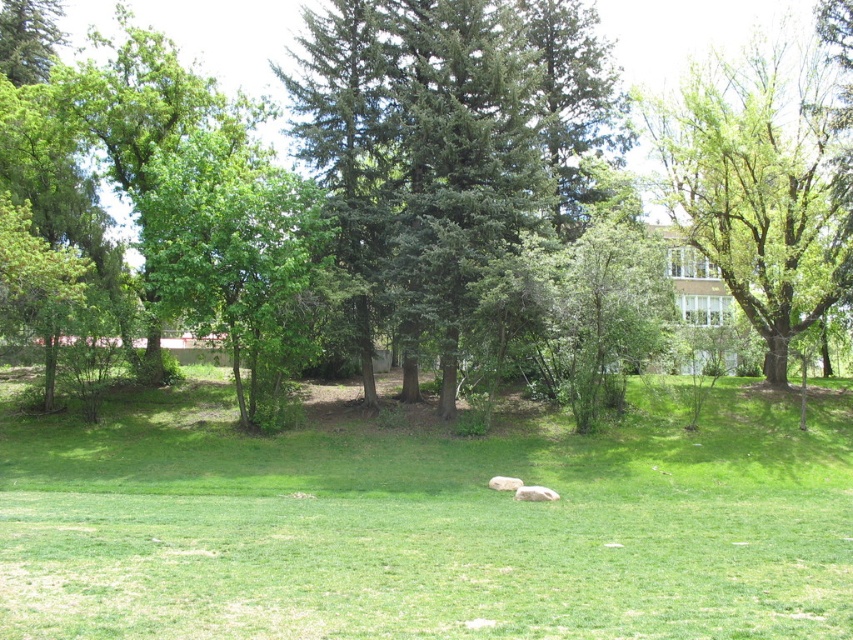
You are planning to set up a small tent in the green grassy field at center. Considering the height of the green leafy tree at upper right, will the tree block sunlight from reaching your tent during the afternoon?

The green grassy field at center is shorter than the green leafy tree at upper right, so the tree may block sunlight from reaching your tent during the afternoon depending on the sun angle.

You are planning to install a small garden shed in the green grassy field at center. The shed requires a minimum of 100 feet of clearance from any nearby trees to prevent root damage. Based on the scene, will the green leafy tree at center be a problem for the shed placement?

The green grassy field at center and green leafy tree at center are 101.03 feet apart. Since the required clearance is 100 feet, the distance is sufficient, so the green leafy tree at center will not be a problem for the shed placement.